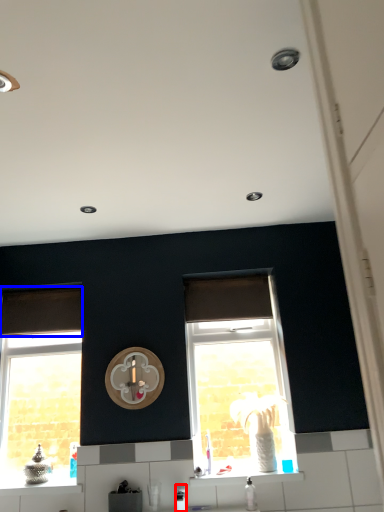
Question: Which object appears closest to the camera in this image, appliance (highlighted by a red box) or curtain (highlighted by a blue box)?

Choices:
 (A) appliance
 (B) curtain

Answer: (A)